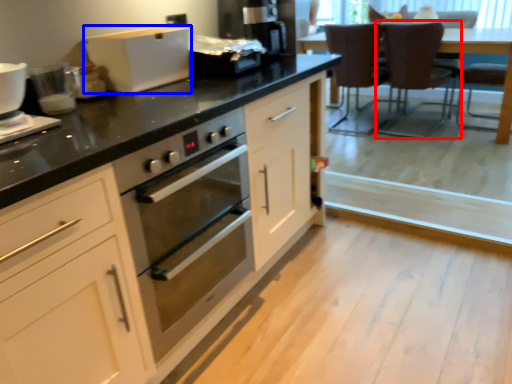
Question: Which of the following is the closest to the observer, chair (highlighted by a red box) or home appliance (highlighted by a blue box)?

Choices:
 (A) chair
 (B) home appliance

Answer: (B)